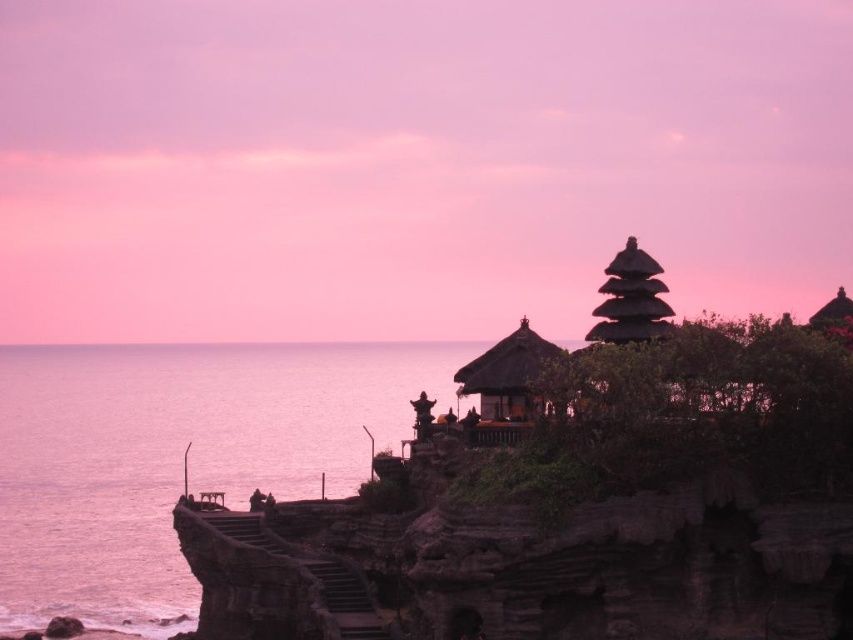
Based on the photo, between transparent water at left and matte brown pagoda at upper right, which one is positioned higher?

matte brown pagoda at upper right

Is point (3, 362) in front of point (637, 304)?

No, (3, 362) is behind (637, 304).

Find the location of a particular element. transparent water at left is located at coordinates (177, 458).

Is transparent water at left wider than wooden thatched roof gazebo at center?

Indeed, transparent water at left has a greater width compared to wooden thatched roof gazebo at center.

Looking at this image, who is positioned more to the left, transparent water at left or wooden thatched roof gazebo at center?

From the viewer's perspective, transparent water at left appears more on the left side.

Is point (357, 467) closer to viewer compared to point (538, 342)?

No, it is behind (538, 342).

The width and height of the screenshot is (853, 640). Identify the location of transparent water at left. (177, 458).

In the scene shown: Does wooden thatched roof gazebo at center appear on the right side of matte brown pagoda at upper right?

No, wooden thatched roof gazebo at center is not to the right of matte brown pagoda at upper right.

I want to click on wooden thatched roof gazebo at center, so click(506, 387).